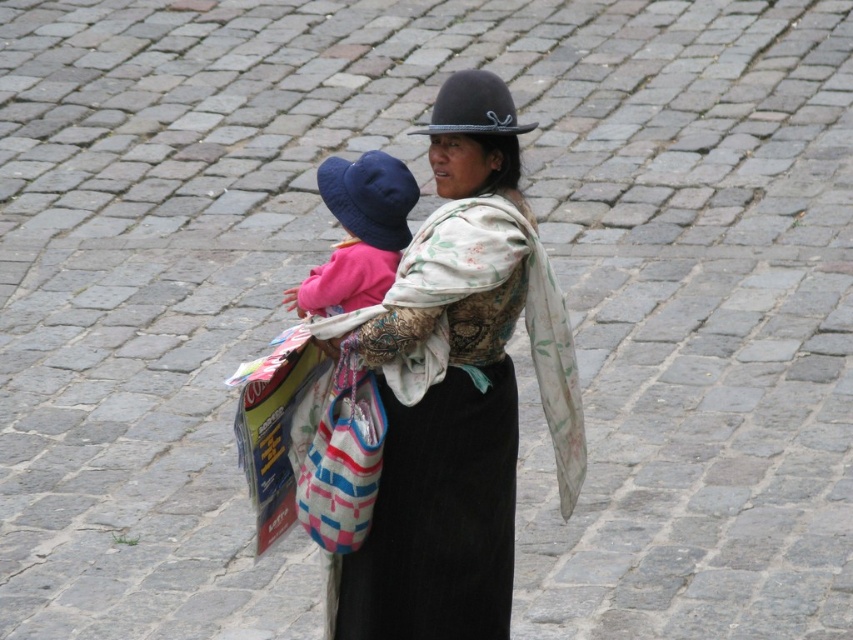
You are a photographer trying to capture the woman and her child in the image. You notice a point at coordinates (456, 388). What object is this point located on?

The point at coordinates (456, 388) is located on the matte black hat at center.

In the scene shown: You are a photographer trying to capture the woman and her child. You notice the matte black hat at center and the matte blue fabric hat at upper center. Which hat will appear larger in the photo?

The matte black hat at center will appear larger in the photo because it is positioned in front of the matte blue fabric hat at upper center, making it closer to the camera.

You are an observer standing on the cobblestone street. You notice two hats on the woman. Which one is positioned to the left when looking at the matte black hat at center and the black felt hat at center?

The matte black hat at center is positioned to the left of the black felt hat at center.